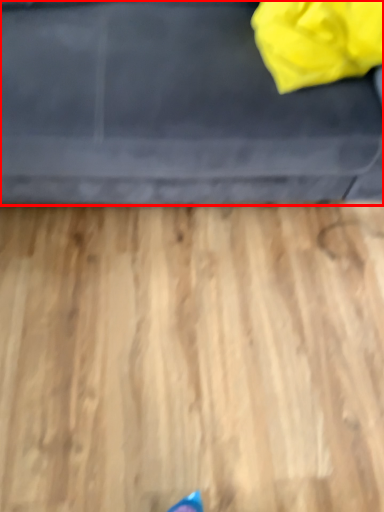
Question: Observing the image, what is the correct spatial positioning of furniture (annotated by the red box) in reference to bag?

Choices:
 (A) right
 (B) left

Answer: (B)